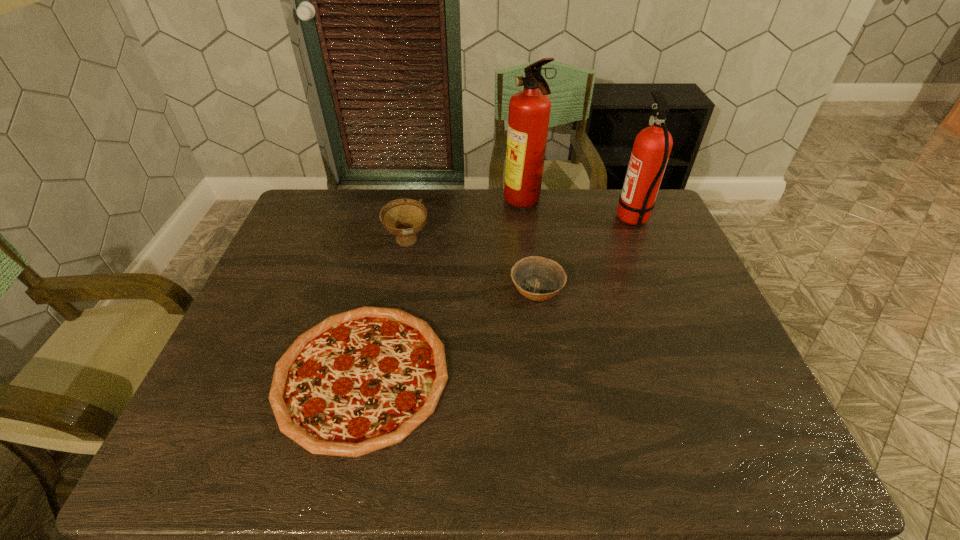
Where is `free space that satisfies the following two spatial constraints: 1. on the front-facing side of the taller fire extinguisher; 2. on the left side of the bowl`? The width and height of the screenshot is (960, 540). free space that satisfies the following two spatial constraints: 1. on the front-facing side of the taller fire extinguisher; 2. on the left side of the bowl is located at coordinates (534, 288).

At what (x,y) coordinates should I click in order to perform the action: click on free point that satisfies the following two spatial constraints: 1. on the front-facing side of the tallest object; 2. on the left side of the second shortest object. Please return your answer as a coordinate pair (x, y). The height and width of the screenshot is (540, 960). Looking at the image, I should click on (534, 288).